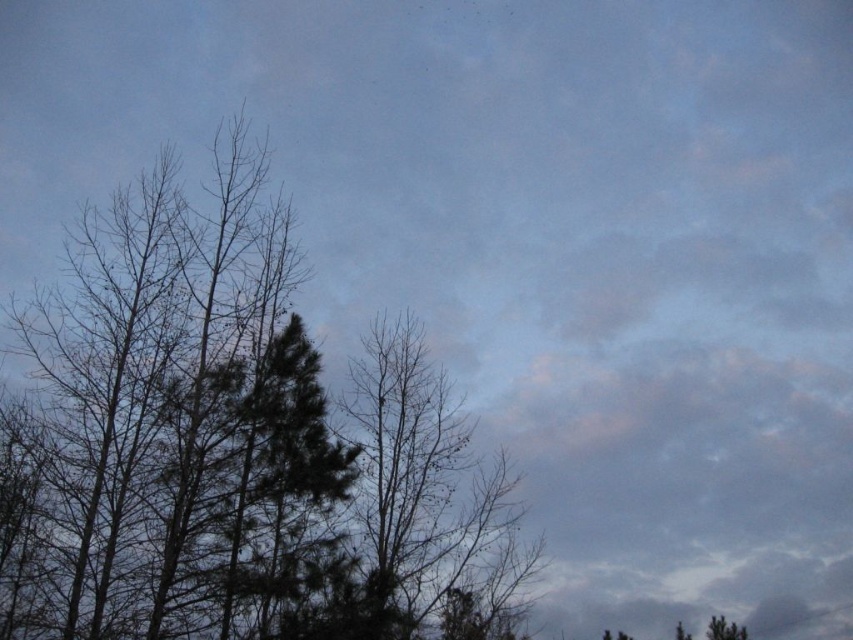
Which is more to the left, dark green leafy tree at left or bare branches at center?

From the viewer's perspective, dark green leafy tree at left appears more on the left side.

Can you confirm if dark green leafy tree at left is positioned to the right of bare branches at center?

In fact, dark green leafy tree at left is to the left of bare branches at center.

This screenshot has height=640, width=853. Identify the location of dark green leafy tree at left. [236, 445].